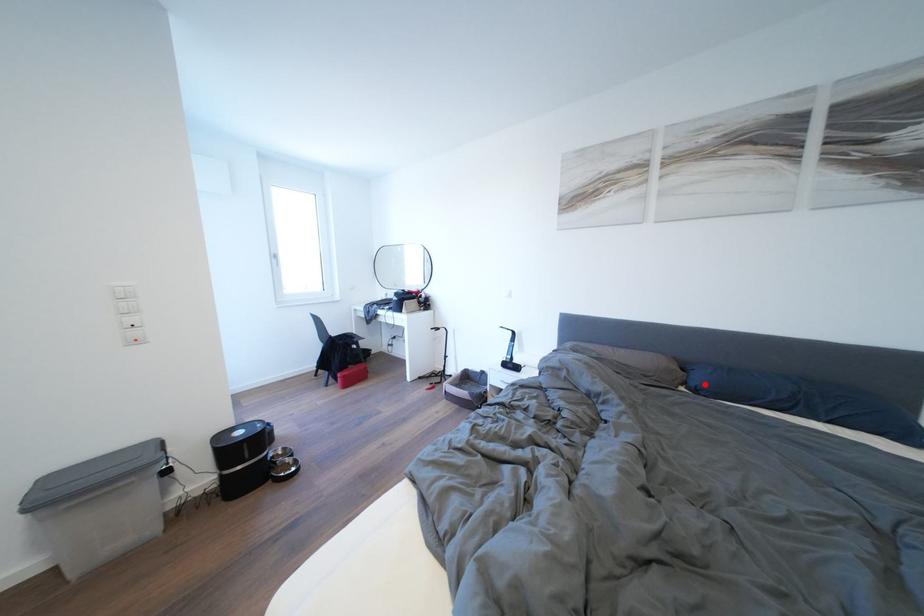
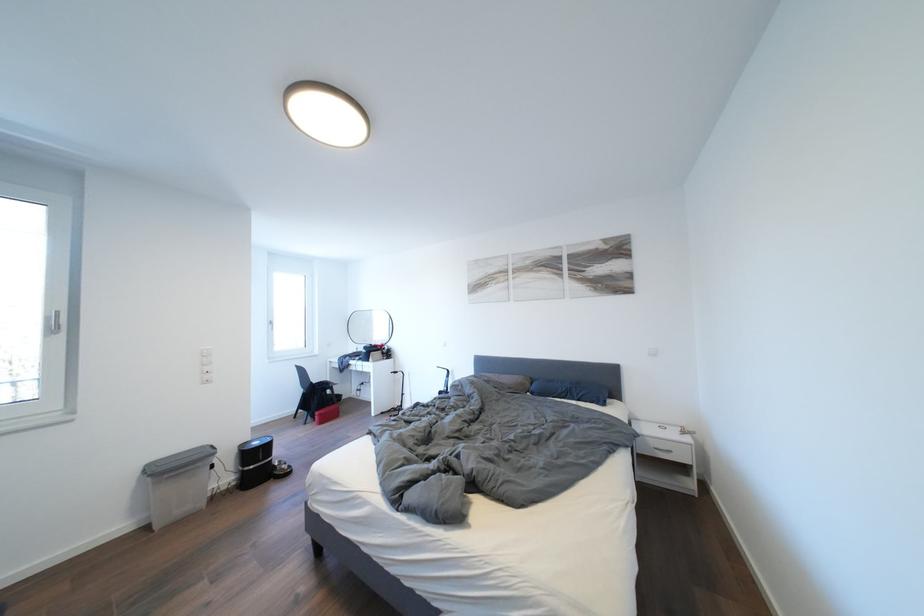
Locate, in the second image, the point that corresponds to the highlighted location in the first image.

(541, 392)